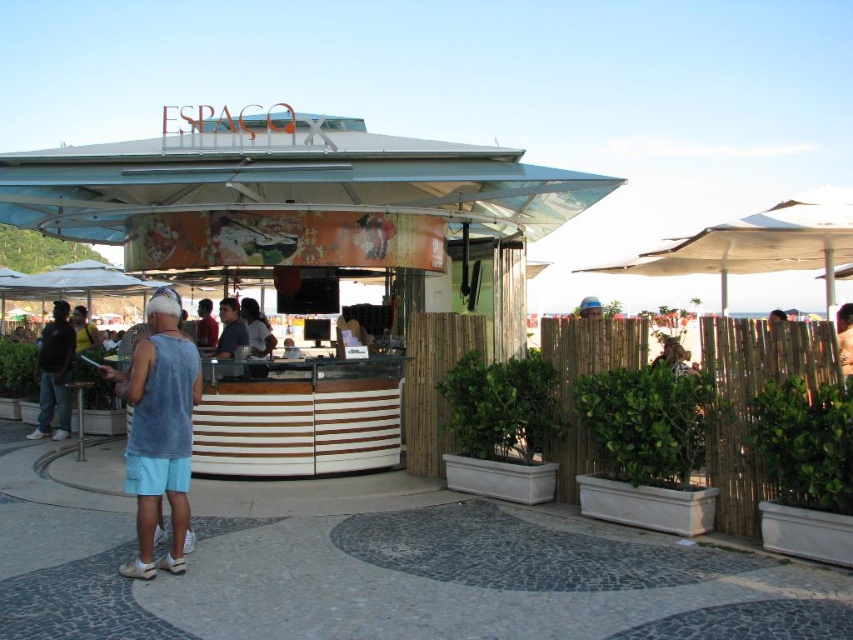
Does blue cotton tank top at center have a greater width compared to dark gray tank top at left?

Indeed, blue cotton tank top at center has a greater width compared to dark gray tank top at left.

Locate an element on the screen. blue cotton tank top at center is located at coordinates (160, 429).

Locate an element on the screen. This screenshot has height=640, width=853. blue cotton tank top at center is located at coordinates (160, 429).

At what (x,y) coordinates should I click in order to perform the action: click on blue cotton tank top at center. Please return your answer as a coordinate pair (x, y). Looking at the image, I should click on pos(160,429).